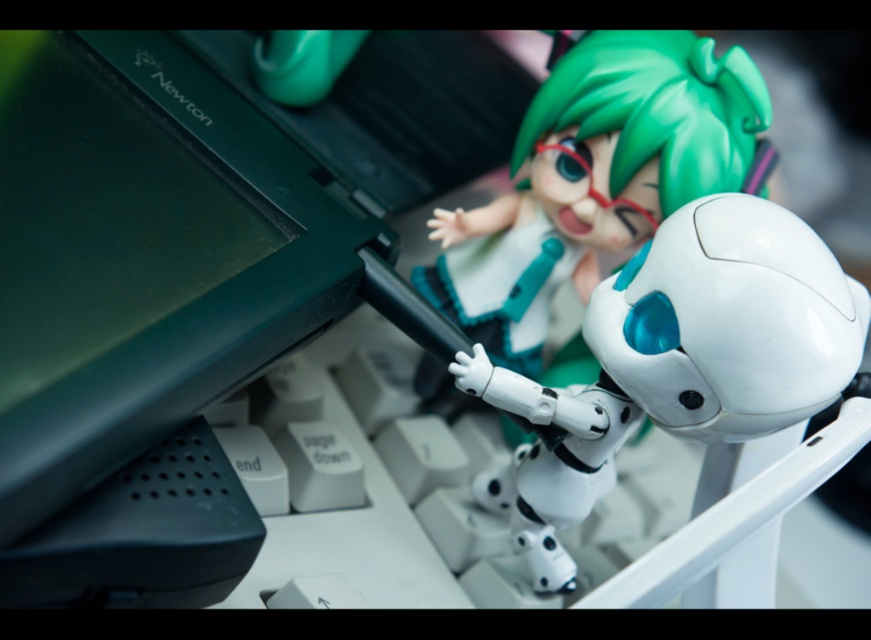
Question: Which of these objects is positioned closest to the white matte robot at center?

Choices:
 (A) matte white robot at center
 (B) black plastic computer at center

Answer: (A)

Question: Does black plastic computer at center appear on the right side of white matte robot at center?

Choices:
 (A) yes
 (B) no

Answer: (B)

Question: Which object is the farthest from the white matte robot at center?

Choices:
 (A) black plastic computer at center
 (B) matte white robot at center

Answer: (A)

Question: Is black plastic computer at center positioned at the back of white matte robot at center?

Choices:
 (A) no
 (B) yes

Answer: (A)

Question: Is white matte robot at center further to camera compared to matte white robot at center?

Choices:
 (A) yes
 (B) no

Answer: (B)

Question: Among these objects, which one is nearest to the camera?

Choices:
 (A) white matte robot at center
 (B) black plastic computer at center

Answer: (B)